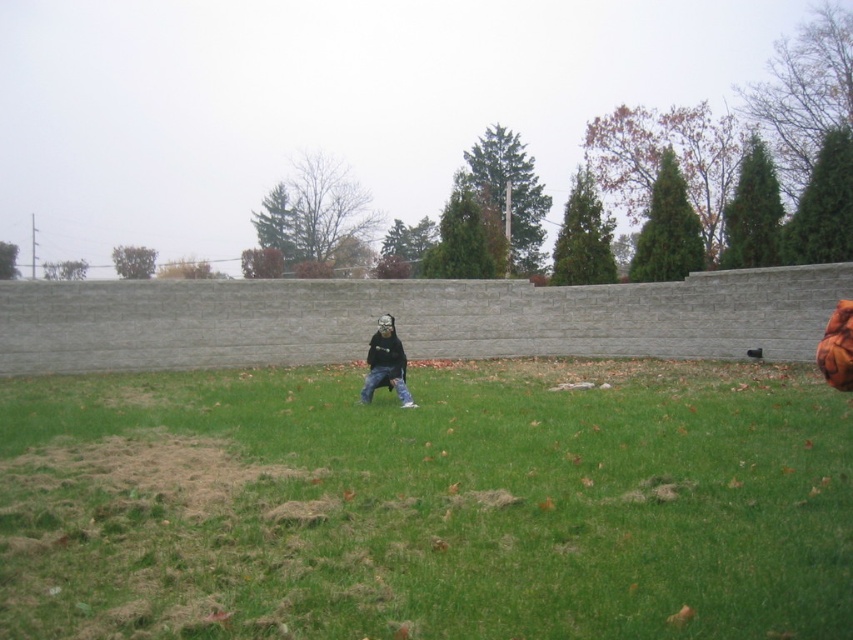
You are a drone operator trying to land a drone on a specific spot in the image. The coordinates given are point (428, 502). According to the scene description, what is the object located at this coordinate?

The point (428, 502) corresponds to green grass at center.

From the picture: You are a photographer trying to capture a closeup of the matte black mask at center while ensuring the green grass at center is also visible in the shot. Based on their positions, will you need to adjust your focus to include both in the frame?

The green grass at center is closer to the viewer than the matte black mask at center, so you will need to adjust your focus to ensure both are in the frame since they are at different distances.